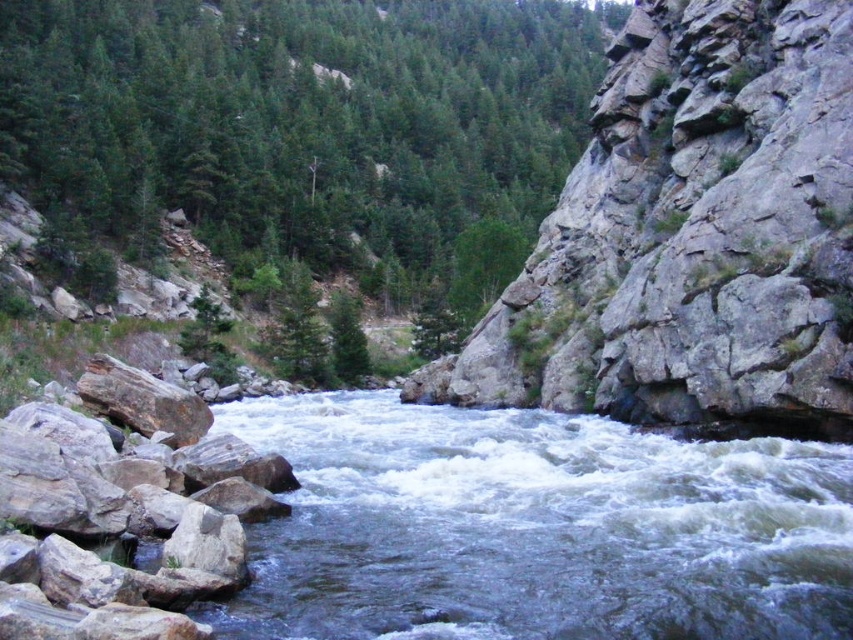
Question: Which object is positioned closest to the clear water at center?

Choices:
 (A) gray rough rock at lower left
 (B) green matte tree at upper center

Answer: (A)

Question: Which point is closer to the camera?

Choices:
 (A) (393, 115)
 (B) (218, 468)

Answer: (B)

Question: Which of these objects is positioned closest to the green matte tree at upper center?

Choices:
 (A) gray rough rock at lower left
 (B) clear water at center

Answer: (B)

Question: Does green matte tree at upper center lie in front of gray rough rock at lower left?

Choices:
 (A) no
 (B) yes

Answer: (A)

Question: Considering the relative positions of green matte tree at upper center and clear water at center in the image provided, where is green matte tree at upper center located with respect to clear water at center?

Choices:
 (A) left
 (B) right

Answer: (A)

Question: Is green matte tree at upper center in front of gray rough rock at lower left?

Choices:
 (A) yes
 (B) no

Answer: (B)